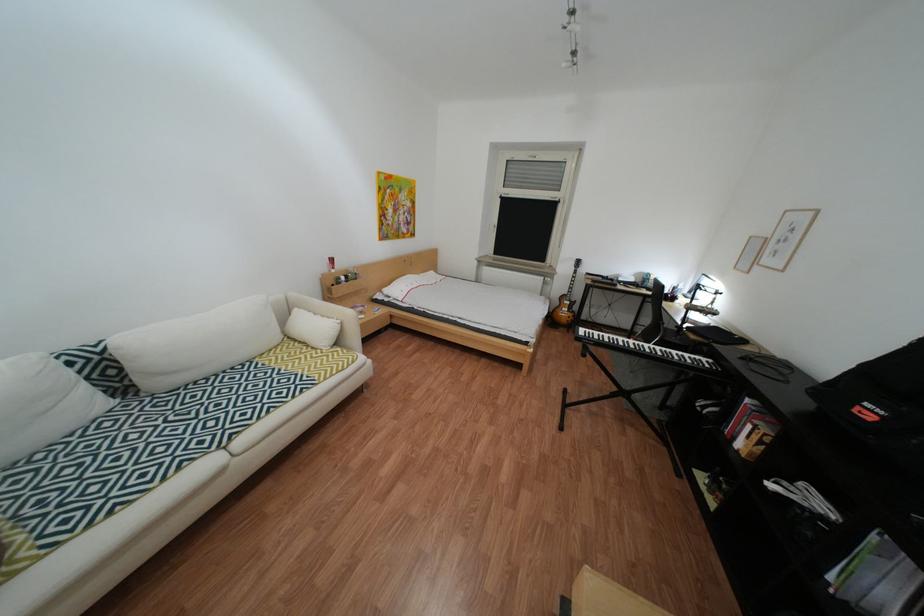
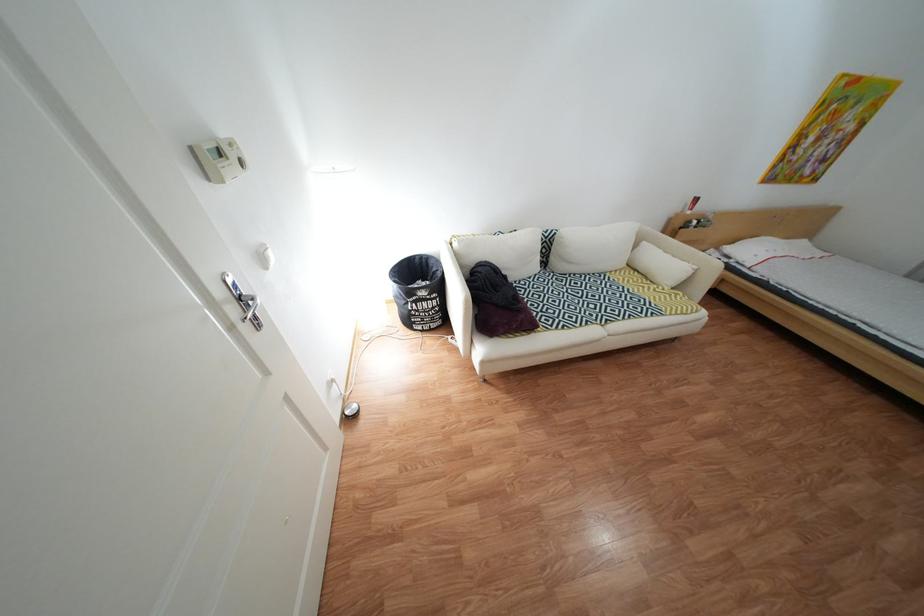
Where in the second image is the point corresponding to the point at 403,291 from the first image?

(744, 249)